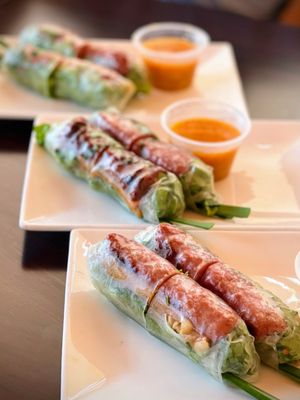
This screenshot has width=300, height=400. Identify the location of plates. (89, 326), (46, 191), (14, 97).